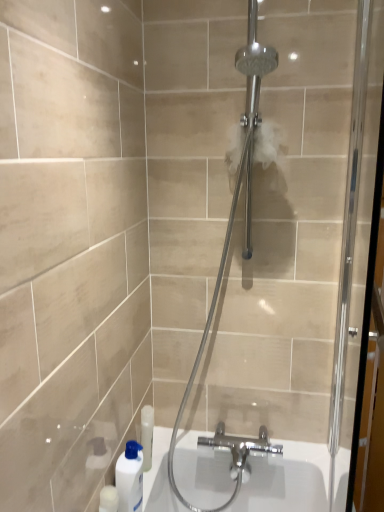
In order to face clear glass screen door at right, should I rotate leftwards or rightwards?

Turn right by 20.046 degrees to look at clear glass screen door at right.

Where is `white glossy bottle at lower left`? white glossy bottle at lower left is located at coordinates (130, 477).

Locate an element on the screen. The height and width of the screenshot is (512, 384). clear glass screen door at right is located at coordinates (349, 227).

Is clear glass shower door at center inside or outside of white glossy bottle at lower left?

clear glass shower door at center is outside white glossy bottle at lower left.

Is the position of clear glass shower door at center less distant than that of white glossy bottle at lower left?

Yes.

Considering the sizes of objects clear glass shower door at center and white glossy bottle at lower left in the image provided, who is thinner, clear glass shower door at center or white glossy bottle at lower left?

With smaller width is white glossy bottle at lower left.

Is clear glass shower door at center inside the boundaries of clear glass screen door at right, or outside?

clear glass shower door at center is spatially situated outside clear glass screen door at right.

In terms of height, does clear glass shower door at center look taller or shorter compared to clear glass screen door at right?

Clearly, clear glass shower door at center is taller compared to clear glass screen door at right.

Is the position of clear glass shower door at center less distant than that of clear glass screen door at right?

That is False.

How far apart are white glossy bottle at lower left and clear glass shower door at center?

white glossy bottle at lower left and clear glass shower door at center are 30.07 inches apart.

Is white glossy bottle at lower left not close to clear glass shower door at center?

white glossy bottle at lower left is actually quite close to clear glass shower door at center.

Is white glossy bottle at lower left turned away from clear glass shower door at center?

No, white glossy bottle at lower left is not facing the opposite direction of clear glass shower door at center.

Between point (123, 492) and point (166, 17), which one is positioned behind?

Point (166, 17)

Who is shorter, white glossy bottle at lower left or clear glass screen door at right?

white glossy bottle at lower left is shorter.

Considering the relative positions of white glossy bottle at lower left and clear glass screen door at right in the image provided, is white glossy bottle at lower left to the right of clear glass screen door at right from the viewer's perspective?

No, white glossy bottle at lower left is not to the right of clear glass screen door at right.

Is point (139, 458) closer or farther from the camera than point (338, 426)?

Point (139, 458) is positioned closer to the camera compared to point (338, 426).

Consider the image. Considering the sizes of objects clear glass screen door at right and clear glass shower door at center in the image provided, who is bigger, clear glass screen door at right or clear glass shower door at center?

clear glass shower door at center.

Which object is thinner, clear glass screen door at right or clear glass shower door at center?

Thinner between the two is clear glass screen door at right.

Is clear glass screen door at right next to clear glass shower door at center?

No.

From a real-world perspective, is clear glass screen door at right located beneath white glossy bottle at lower left?

No, from a real-world perspective, clear glass screen door at right is not below white glossy bottle at lower left.

Considering the positions of objects clear glass screen door at right and white glossy bottle at lower left in the image provided, who is behind, clear glass screen door at right or white glossy bottle at lower left?

white glossy bottle at lower left is more distant.

Is clear glass screen door at right turned away from white glossy bottle at lower left?

Absolutely, clear glass screen door at right is directed away from white glossy bottle at lower left.

Locate an element on the screen. cleaning product that appears on the left of clear glass shower door at center is located at coordinates (130, 477).

Image resolution: width=384 pixels, height=512 pixels. I want to click on screen door positioned vertically above the clear glass shower door at center (from a real-world perspective), so click(349, 227).

Looking at the image, which one is located further to clear glass screen door at right, white glossy bottle at lower left or clear glass shower door at center?

white glossy bottle at lower left is positioned further to the anchor clear glass screen door at right.

Considering their positions, is clear glass shower door at center positioned further to white glossy bottle at lower left than clear glass screen door at right?

clear glass screen door at right lies further to white glossy bottle at lower left than the other object.

From the image, which object appears to be nearer to white glossy bottle at lower left, clear glass screen door at right or clear glass shower door at center?

clear glass shower door at center lies closer to white glossy bottle at lower left than the other object.

From the image, which object appears to be farther from clear glass shower door at center, white glossy bottle at lower left or clear glass screen door at right?

Among the two, white glossy bottle at lower left is located further to clear glass shower door at center.

From the image, which object appears to be farther from clear glass screen door at right, clear glass shower door at center or white glossy bottle at lower left?

white glossy bottle at lower left is further to clear glass screen door at right.

Which object lies nearer to the anchor point clear glass shower door at center, clear glass screen door at right or white glossy bottle at lower left?

clear glass screen door at right is closer to clear glass shower door at center.

Locate an element on the screen. shower door positioned between clear glass screen door at right and white glossy bottle at lower left from near to far is located at coordinates (299, 234).